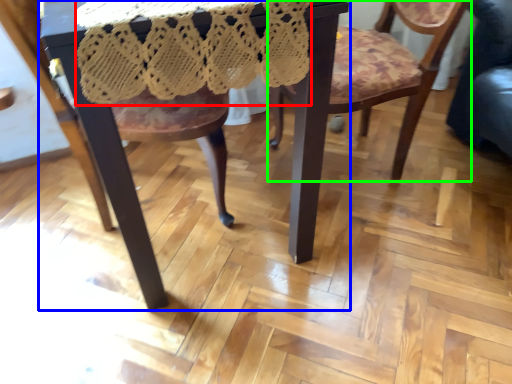
Question: Which object is positioned closest to lace dress (highlighted by a red box)? Select from table (highlighted by a blue box) and chair (highlighted by a green box).

Choices:
 (A) table
 (B) chair

Answer: (A)